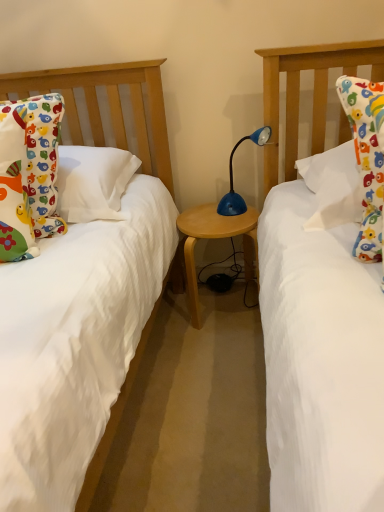
This screenshot has height=512, width=384. I want to click on free location to the left of blue plastic lamp at center, so click(x=204, y=218).